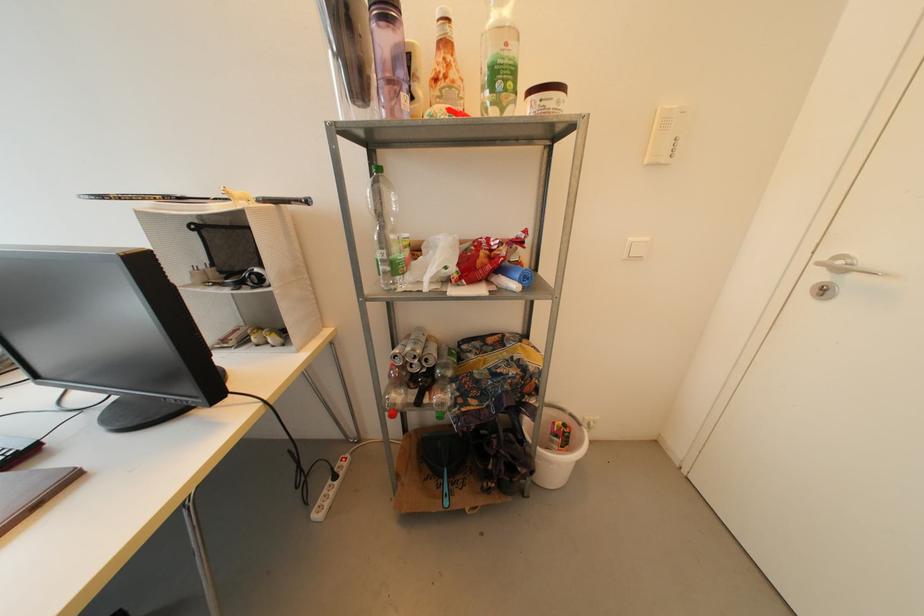
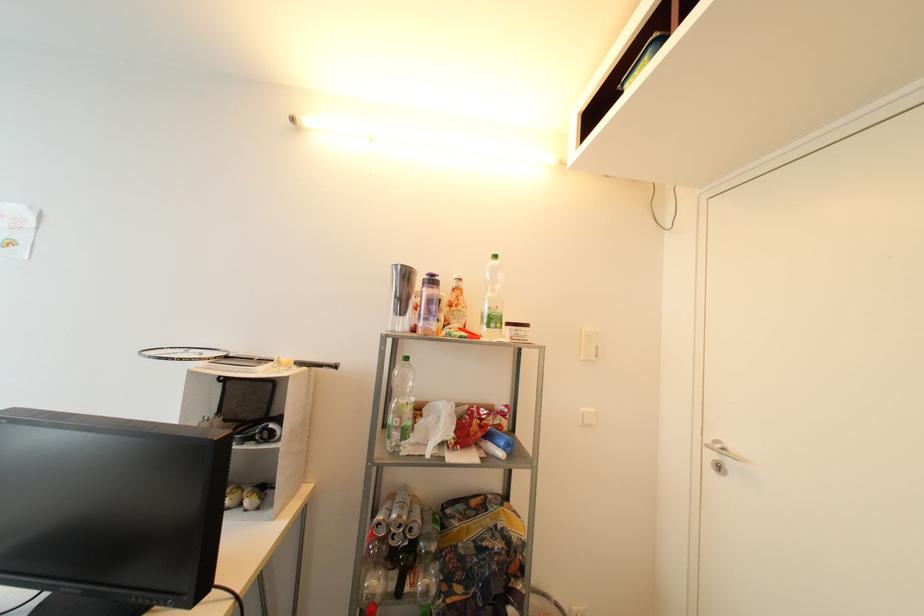
Find the pixel in the second image that matches [186,201] in the first image.

(232, 359)